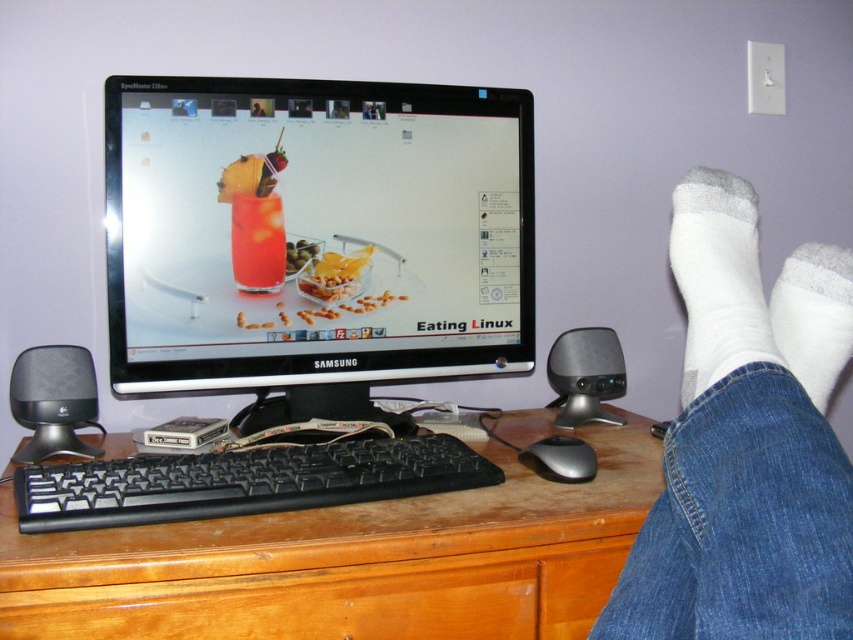
Which is behind, point (160, 278) or point (625, 381)?

The point (625, 381) is behind.

Is black glossy monitor at center smaller than silver metallic speaker at lower right?

Incorrect, black glossy monitor at center is not smaller in size than silver metallic speaker at lower right.

At what (x,y) coordinates should I click in order to perform the action: click on black glossy monitor at center. Please return your answer as a coordinate pair (x, y). This screenshot has height=640, width=853. Looking at the image, I should click on (317, 237).

Is white cotton sock at lower right thinner than black plastic speaker at left?

Yes, white cotton sock at lower right is thinner than black plastic speaker at left.

How far apart are white cotton sock at lower right and black plastic speaker at left?

29.56 inches

Is point (833, 250) closer to viewer compared to point (73, 406)?

Yes, point (833, 250) is closer to viewer.

What are the coordinates of `white cotton sock at lower right` in the screenshot? It's located at (814, 316).

Is point (759, 324) less distant than point (36, 614)?

Yes, it is.

Can you confirm if white cotton socks at upper right is positioned to the right of glossy wood drawer at lower center?

Correct, you'll find white cotton socks at upper right to the right of glossy wood drawer at lower center.

The height and width of the screenshot is (640, 853). In order to click on white cotton socks at upper right in this screenshot , I will do `click(746, 442)`.

Image resolution: width=853 pixels, height=640 pixels. I want to click on white cotton socks at upper right, so click(x=746, y=442).